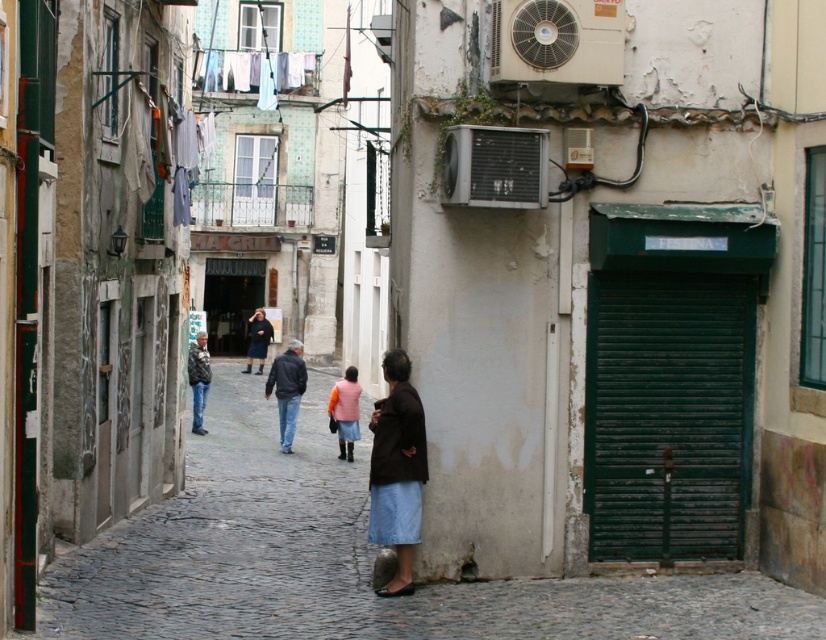
Who is higher up, denim skirt at center or dark gray leather jacket at center?

dark gray leather jacket at center is above.

The image size is (826, 640). In order to click on denim skirt at center in this screenshot , I will do `click(397, 470)`.

At what (x,y) coordinates should I click in order to perform the action: click on denim skirt at center. Please return your answer as a coordinate pair (x, y). Image resolution: width=826 pixels, height=640 pixels. Looking at the image, I should click on (397, 470).

Is point (195, 417) positioned before point (248, 339)?

Yes, point (195, 417) is in front of point (248, 339).

Who is positioned more to the right, jeans at center or dark blue skirt at center?

Positioned to the right is jeans at center.

Identify the location of jeans at center. The image size is (826, 640). (198, 378).

Find the location of a particular element. This screenshot has width=826, height=640. jeans at center is located at coordinates (198, 378).

Who is positioned more to the right, dark gray leather jacket at center or jeans at center?

From the viewer's perspective, dark gray leather jacket at center appears more on the right side.

Where is `dark gray leather jacket at center`? dark gray leather jacket at center is located at coordinates (287, 388).